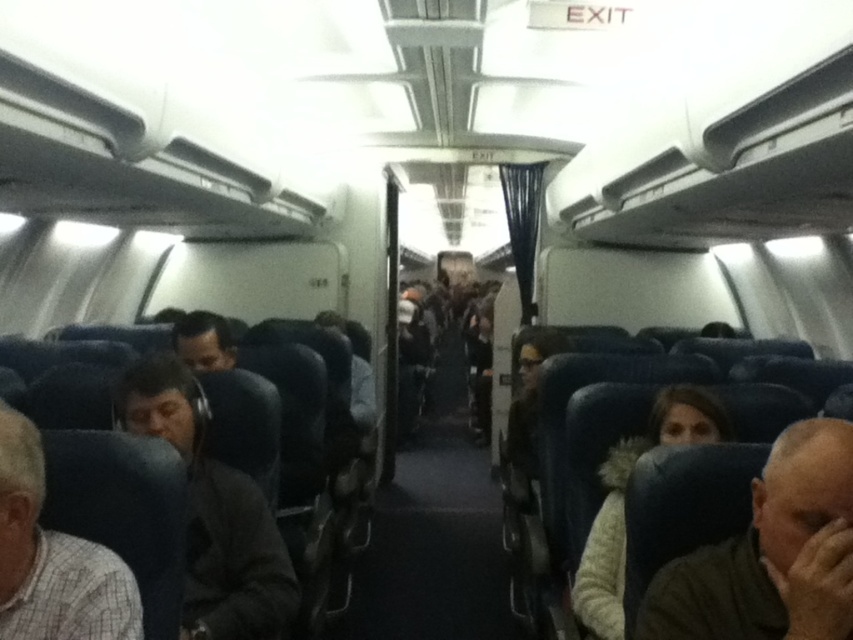
Who is positioned more to the left, dark gray fabric headrest at lower right or white fuzzy sweater at center?

dark gray fabric headrest at lower right

Can you confirm if dark gray fabric headrest at lower right is wider than white fuzzy sweater at center?

No.

Does point (819, 618) come behind point (619, 480)?

No.

At what (x,y) coordinates should I click in order to perform the action: click on dark gray fabric headrest at lower right. Please return your answer as a coordinate pair (x, y). This screenshot has width=853, height=640. Looking at the image, I should click on (770, 554).

What do you see at coordinates (212, 513) in the screenshot? The height and width of the screenshot is (640, 853). I see `black matte headphones at left` at bounding box center [212, 513].

Which is behind, point (192, 620) or point (608, 461)?

The point (608, 461) is behind.

Find the location of a particular element. black matte headphones at left is located at coordinates (212, 513).

Which of these two, white checkered shirt at left or white fuzzy sweater at center, stands shorter?

white checkered shirt at left is shorter.

Is white checkered shirt at left closer to the viewer compared to white fuzzy sweater at center?

Yes.

What are the coordinates of `white checkered shirt at left` in the screenshot? It's located at (51, 557).

The width and height of the screenshot is (853, 640). Identify the location of white checkered shirt at left. (51, 557).